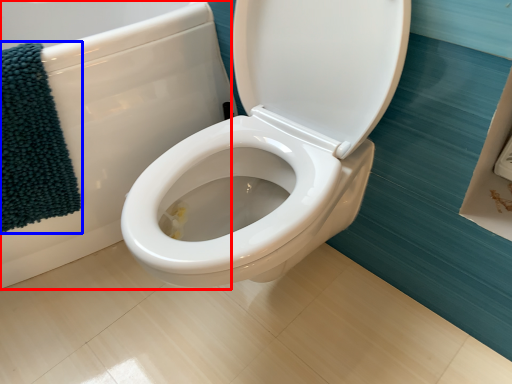
Question: Which object is closer to the camera taking this photo, bath (highlighted by a red box) or bath towel (highlighted by a blue box)?

Choices:
 (A) bath
 (B) bath towel

Answer: (A)